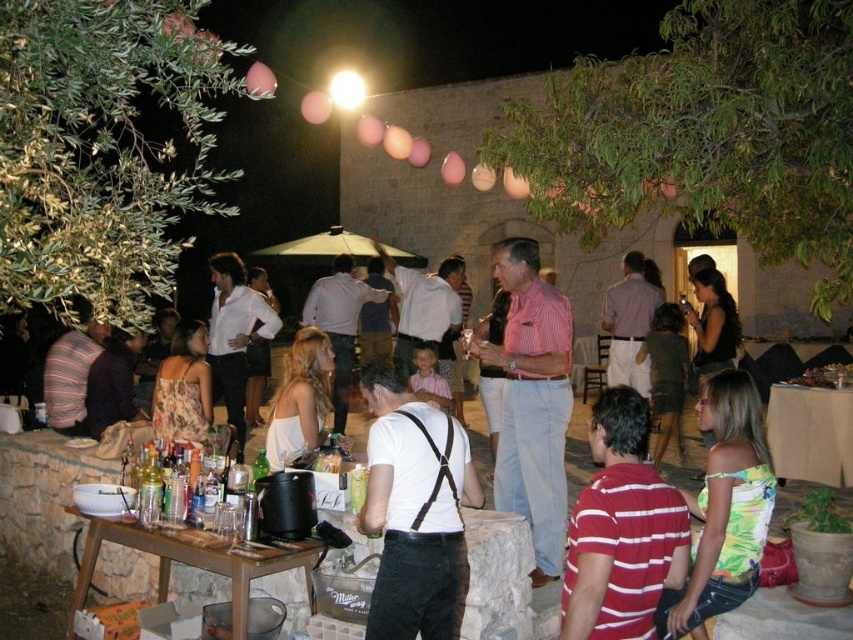
You are at the outdoor evening gathering and want to know which clothing item is closer to the ground between the striped cotton shirt at center and the white fabric dress at center. Which one is it?

The striped cotton shirt at center is positioned under the white fabric dress at center, so it is closer to the ground.

You are standing at the point closer to the camera between the two points, point (x=370, y=440) and point (x=602, y=480). Which point are you at?

You are at point (x=370, y=440) because it is further to the camera than point (x=602, y=480).

You are standing at the point labeled point (450,484) at an outdoor evening gathering. You want to move to the stone wall behind the table. Can you estimate how far you need to walk from your current position to reach the stone wall?

The distance between point (450,484) and the viewer is 12.72 feet. Since the stone wall is behind the table where you are currently standing, you would need to walk approximately 12.72 feet to reach it.